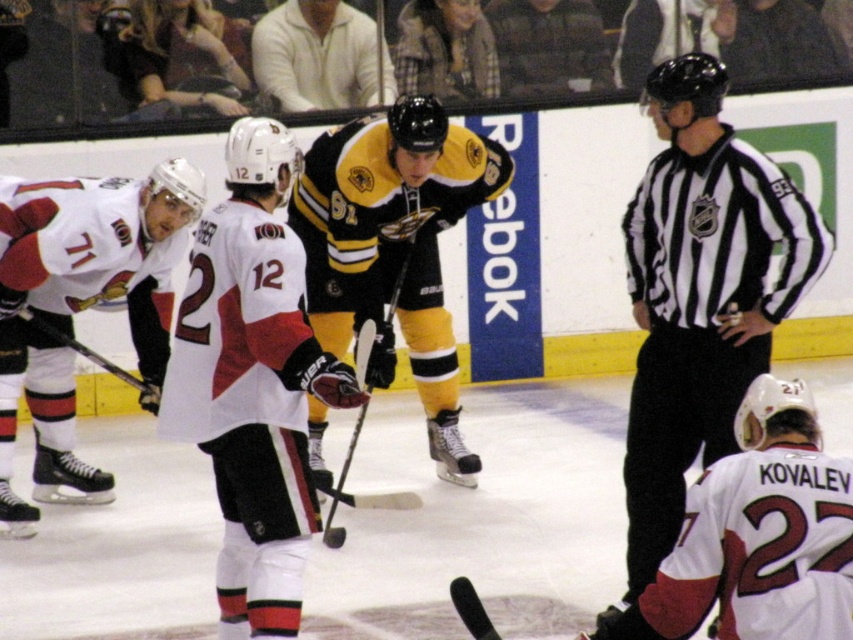
Question: Can you confirm if white matte jersey at left is bigger than white matte jersey at lower right?

Choices:
 (A) yes
 (B) no

Answer: (A)

Question: Does black and white striped shirt at center have a smaller size compared to black matte hockey stick at center?

Choices:
 (A) yes
 (B) no

Answer: (B)

Question: Observing the image, what is the correct spatial positioning of black and white striped shirt at center in reference to white matte jersey at center?

Choices:
 (A) left
 (B) right

Answer: (B)

Question: Which of the following is the farthest from the observer?

Choices:
 (A) white matte jersey at lower right
 (B) black matte hockey stick at center

Answer: (B)

Question: Which object appears closest to the camera in this image?

Choices:
 (A) white matte jersey at center
 (B) white matte jersey at left
 (C) black and white striped shirt at center
 (D) black matte hockey stick at center

Answer: (A)

Question: Which point is farther to the camera?

Choices:
 (A) (347, 454)
 (B) (1, 195)
 (C) (325, 268)

Answer: (C)